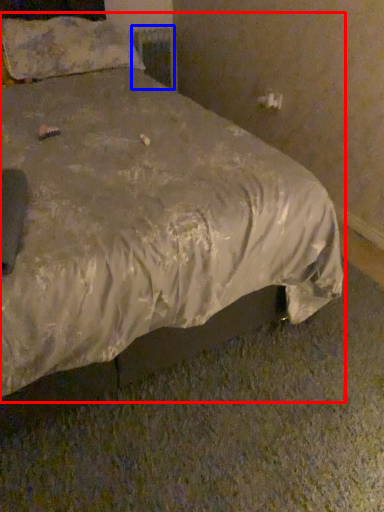
Question: Which of the following is the closest to the observer, bed (highlighted by a red box) or radiator (highlighted by a blue box)?

Choices:
 (A) bed
 (B) radiator

Answer: (A)